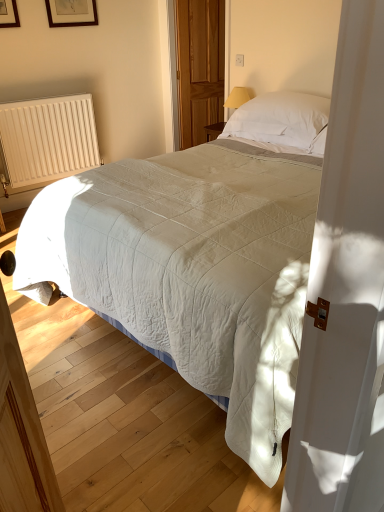
Question: From the image's perspective, relative to white soft pillow at upper center, is white ribbed radiator at left above or below?

Choices:
 (A) above
 (B) below

Answer: (B)

Question: Considering the positions of white ribbed radiator at left and white soft pillow at upper center in the image, is white ribbed radiator at left taller or shorter than white soft pillow at upper center?

Choices:
 (A) short
 (B) tall

Answer: (B)

Question: Based on their relative distances, which object is farther from the white ribbed radiator at left?

Choices:
 (A) wooden picture frame at upper left
 (B) wooden screen door at center
 (C) white soft pillow at upper center
 (D) white quilted bed at center

Answer: (D)

Question: Based on their relative distances, which object is farther from the wooden screen door at center?

Choices:
 (A) white quilted bed at center
 (B) white soft pillow at upper center
 (C) white ribbed radiator at left
 (D) wooden picture frame at upper left

Answer: (A)